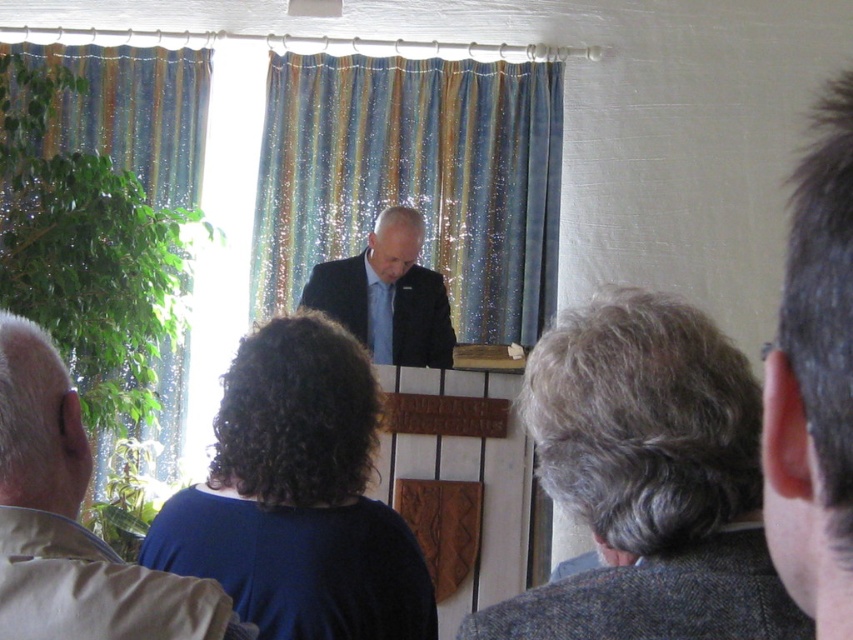
Can you confirm if blue striped curtain at center is shorter than matte black suit at center?

No, blue striped curtain at center is not shorter than matte black suit at center.

Can you confirm if blue striped curtain at center is smaller than matte black suit at center?

Actually, blue striped curtain at center might be larger than matte black suit at center.

Which is in front, point (378, 118) or point (378, 353)?

Point (378, 353) is more forward.

Find the location of `blue striped curtain at center`. blue striped curtain at center is located at coordinates (415, 179).

Is point (9, 317) positioned behind point (556, 582)?

Yes.

Is light brown leather jacket at lower left taller than gray woolen suit at lower right?

Indeed, light brown leather jacket at lower left has a greater height compared to gray woolen suit at lower right.

Find the location of `light brown leather jacket at lower left`. light brown leather jacket at lower left is located at coordinates pos(73,522).

Which of these two, striped fabric curtain at left or gray woolen suit at lower right, stands taller?

With more height is striped fabric curtain at left.

Does striped fabric curtain at left have a lesser width compared to gray woolen suit at lower right?

Incorrect, striped fabric curtain at left's width is not less than gray woolen suit at lower right's.

Which is behind, point (109, 227) or point (614, 580)?

Point (109, 227)

Locate an element on the screen. Image resolution: width=853 pixels, height=640 pixels. striped fabric curtain at left is located at coordinates (103, 214).